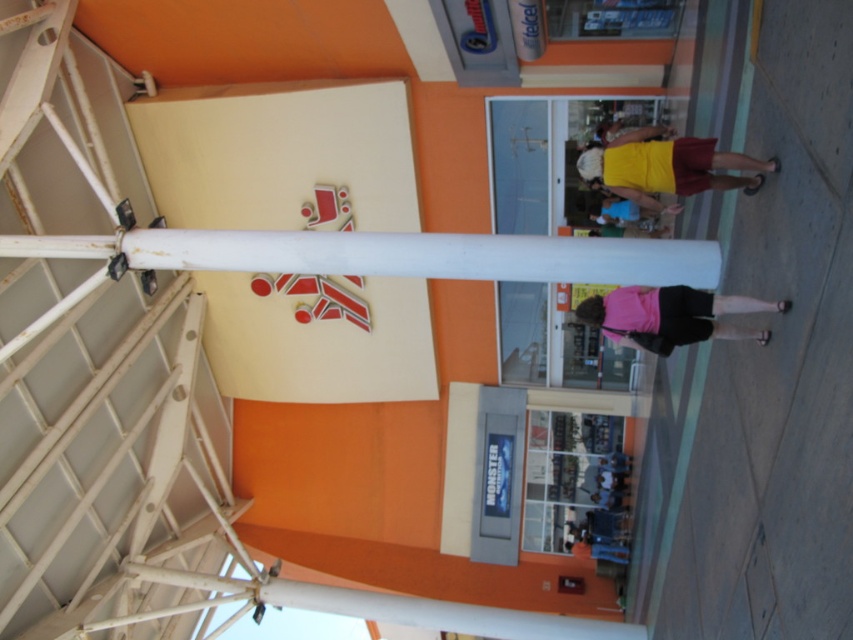
Who is positioned more to the left, yellow matte shirt at upper center or pink fabric at center?

Positioned to the left is pink fabric at center.

From the picture: Between yellow matte shirt at upper center and pink fabric at center, which one is positioned higher?

A: yellow matte shirt at upper center

I want to click on yellow matte shirt at upper center, so click(666, 168).